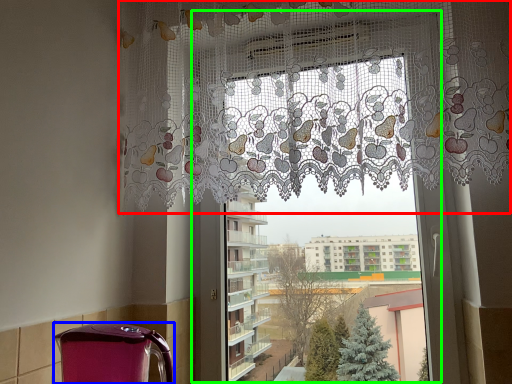
Question: Considering the real-world distances, which object is farthest from curtain (highlighted by a red box)? appliance (highlighted by a blue box) or window frame (highlighted by a green box)?

Choices:
 (A) appliance
 (B) window frame

Answer: (A)